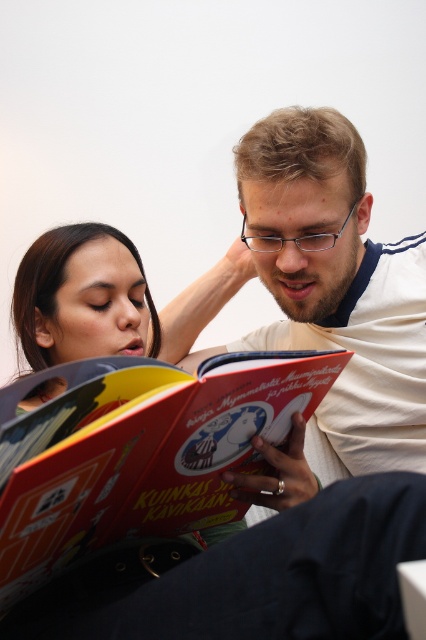
Question: Does matte white shirt at center appear over hardcover book at center?

Choices:
 (A) no
 (B) yes

Answer: (B)

Question: Does matte white shirt at center have a larger size compared to hardcover book at center?

Choices:
 (A) no
 (B) yes

Answer: (B)

Question: Is matte white shirt at center to the left of hardcover book at center from the viewer's perspective?

Choices:
 (A) no
 (B) yes

Answer: (A)